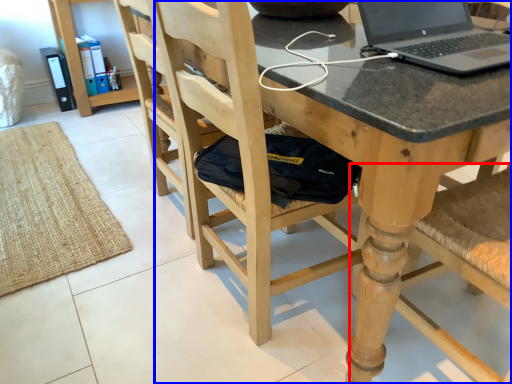
Question: Which of the following is the closest to the observer, chair (highlighted by a red box) or chair (highlighted by a blue box)?

Choices:
 (A) chair
 (B) chair

Answer: (A)